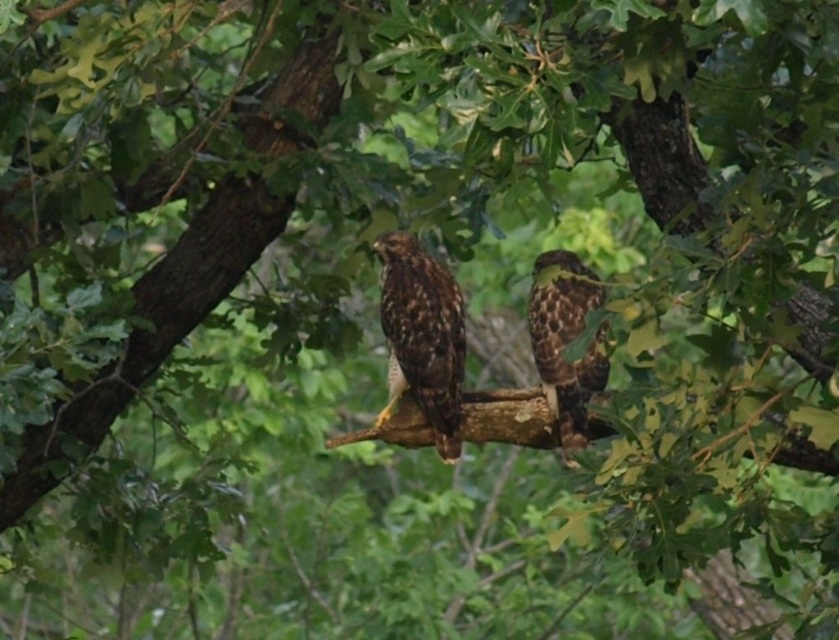
Question: Which of the following is the farthest from the observer?

Choices:
 (A) (384, 404)
 (B) (533, 356)

Answer: (A)

Question: Can you confirm if brown feathered eagle at center is positioned to the left of brown speckled eagle at center?

Choices:
 (A) yes
 (B) no

Answer: (A)

Question: Which object is closer to the camera taking this photo?

Choices:
 (A) brown speckled eagle at center
 (B) brown feathered eagle at center

Answer: (A)

Question: Where is brown feathered eagle at center located in relation to brown speckled eagle at center in the image?

Choices:
 (A) below
 (B) above

Answer: (B)

Question: Which point is farther to the camera?

Choices:
 (A) brown speckled eagle at center
 (B) brown feathered eagle at center

Answer: (B)

Question: Does brown feathered eagle at center have a smaller size compared to brown speckled eagle at center?

Choices:
 (A) no
 (B) yes

Answer: (B)